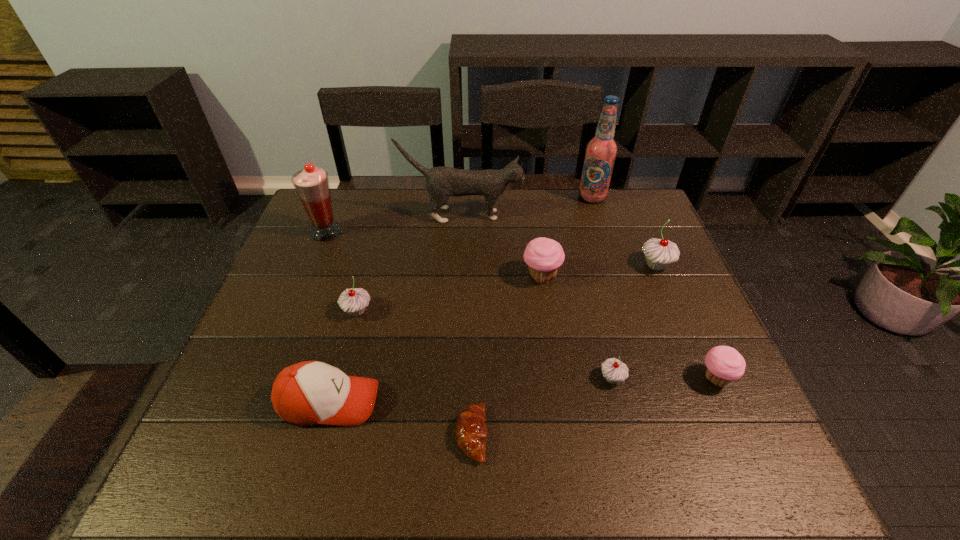
Locate an element on the screen. The width and height of the screenshot is (960, 540). free region located 0.200m on the left of the rightmost gray cupcake is located at coordinates (567, 265).

Find the location of a particular element. This screenshot has width=960, height=540. vacant position located on the front of the fourth cupcake from right to left is located at coordinates (549, 328).

Locate an element on the screen. Image resolution: width=960 pixels, height=540 pixels. vacant region located on the front of the second farthest gray cupcake is located at coordinates (x=335, y=394).

In order to click on vacant space located 0.250m on the front-facing side of the orange baseball cap in this screenshot , I will do `click(496, 402)`.

Locate an element on the screen. This screenshot has width=960, height=540. free space located on the back of the nearer pink cupcake is located at coordinates (671, 279).

This screenshot has width=960, height=540. In order to click on free space located on the right of the fourth object from right to left in this screenshot , I will do `click(647, 379)`.

Find the location of `vacant space situated on the right of the crescent roll`. vacant space situated on the right of the crescent roll is located at coordinates (656, 435).

I want to click on alcohol positioned at the far edge, so click(x=601, y=151).

I want to click on cat located at the far edge, so click(x=442, y=182).

Where is `smoothie that is at the far edge`? smoothie that is at the far edge is located at coordinates (312, 186).